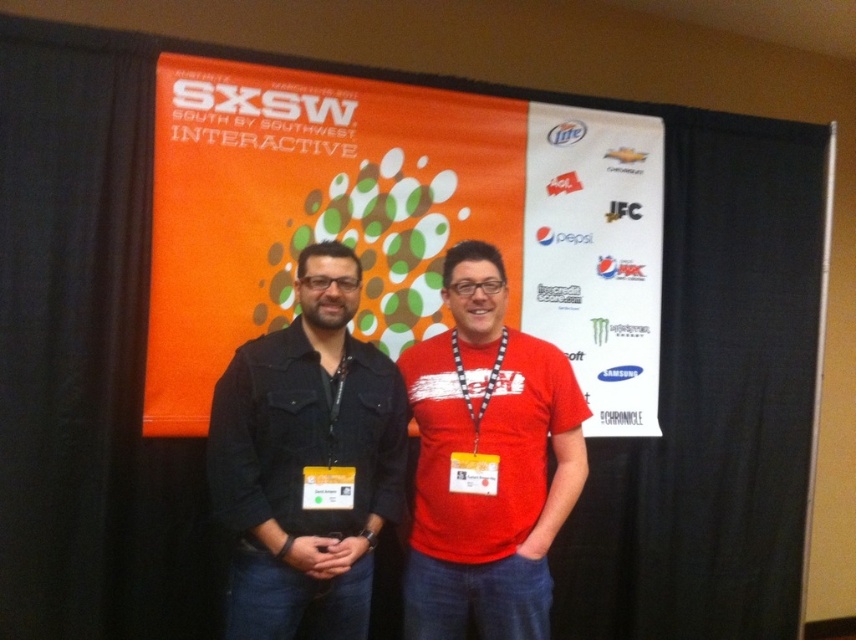
Is point (615, 301) farther from viewer compared to point (415, 486)?

That is True.

Is orange fabric banner at upper center positioned in front of matte red t-shirt at center?

No, it is behind matte red t-shirt at center.

Is point (397, 163) farther from camera compared to point (521, 452)?

Yes.

Image resolution: width=856 pixels, height=640 pixels. Find the location of `orange fabric banner at upper center`. orange fabric banner at upper center is located at coordinates (397, 221).

Describe the element at coordinates (397, 221) in the screenshot. The height and width of the screenshot is (640, 856). I see `orange fabric banner at upper center` at that location.

Does orange fabric banner at upper center have a smaller size compared to denim jacket at center?

Actually, orange fabric banner at upper center might be larger than denim jacket at center.

Is point (449, 134) closer to viewer compared to point (241, 445)?

That is False.

Locate an element on the screen. This screenshot has height=640, width=856. orange fabric banner at upper center is located at coordinates (397, 221).

Is point (295, 616) farther from viewer compared to point (482, 346)?

No.

Locate an element on the screen. Image resolution: width=856 pixels, height=640 pixels. denim jacket at center is located at coordinates (306, 461).